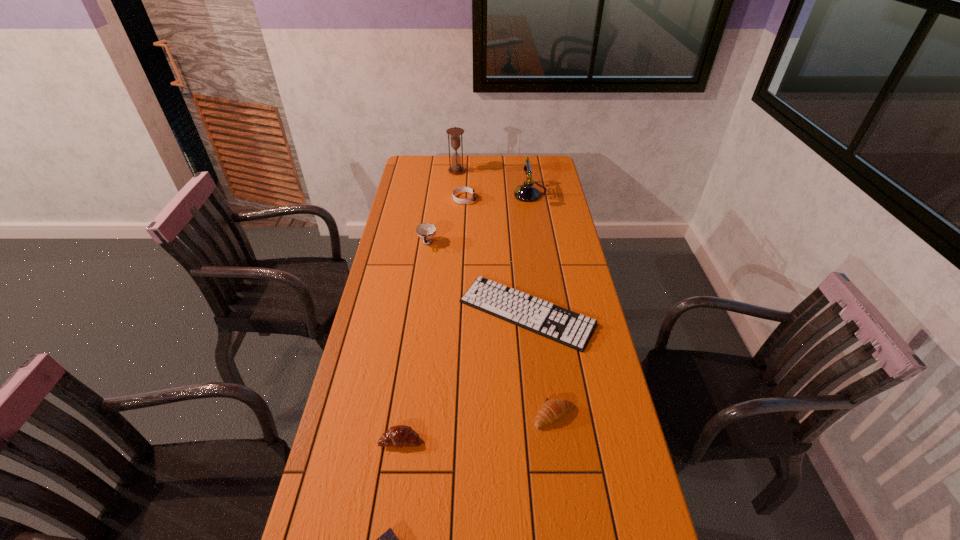
Identify the location of free region located 0.070m on the dial of the telephone. (498, 194).

Where is `vacant space located on the dial of the telephone`? The width and height of the screenshot is (960, 540). vacant space located on the dial of the telephone is located at coordinates (441, 194).

Identify the location of free space located 0.110m on the dial of the telephone. (491, 194).

The image size is (960, 540). I want to click on free spot located 0.400m on the side of the fourth farthest object with the handle, so click(415, 328).

You are a GUI agent. You are given a task and a screenshot of the screen. Output one action in this format:
    pyautogui.click(x=<x>, y=<y>)
    Task: Click on the free space located 0.380m on the outer surface of the wristband
    
    Given the screenshot: What is the action you would take?
    pyautogui.click(x=557, y=199)

Find the location of a particular element. This screenshot has width=960, height=540. blank space located 0.220m on the back of the right crescent roll is located at coordinates (544, 341).

This screenshot has width=960, height=540. I want to click on free space located 0.320m on the right of the left crescent roll, so click(544, 440).

Find the location of `free space located on the left of the computer keyboard`. free space located on the left of the computer keyboard is located at coordinates (409, 313).

Where is `object located in the far edge section of the desktop`? object located in the far edge section of the desktop is located at coordinates (455, 132).

Identify the location of cup that is at the left edge. (427, 231).